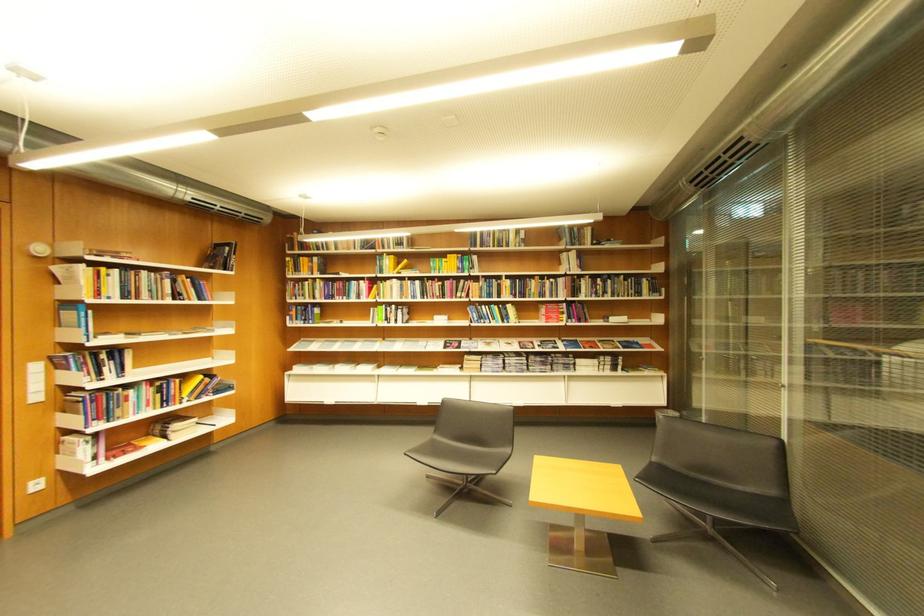
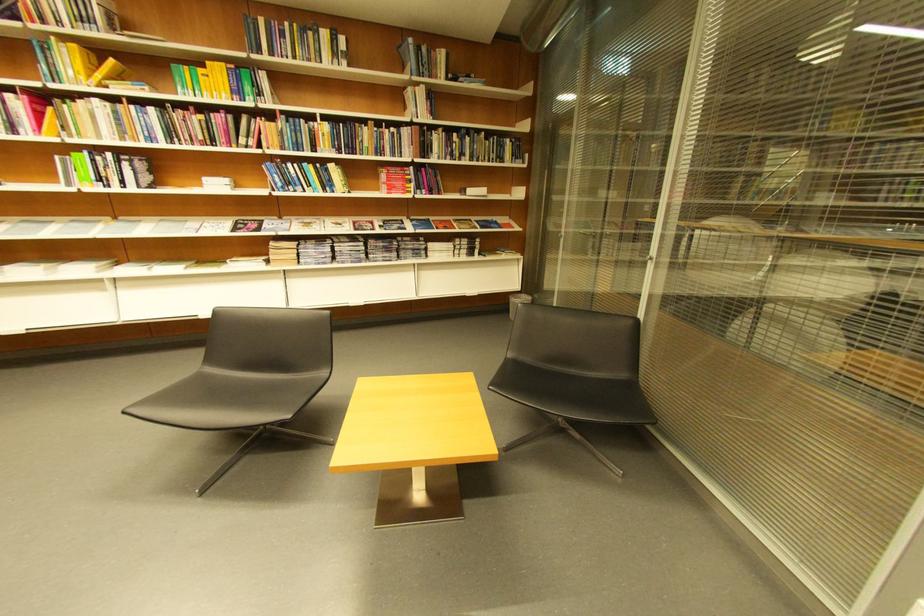
The point at (575, 256) is marked in the first image. Where is the corresponding point in the second image?

(419, 91)